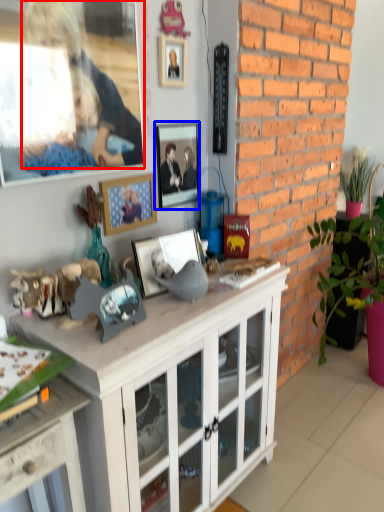
Question: Which of the following is the closest to the observer, person (highlighted by a red box) or picture frame (highlighted by a blue box)?

Choices:
 (A) person
 (B) picture frame

Answer: (A)